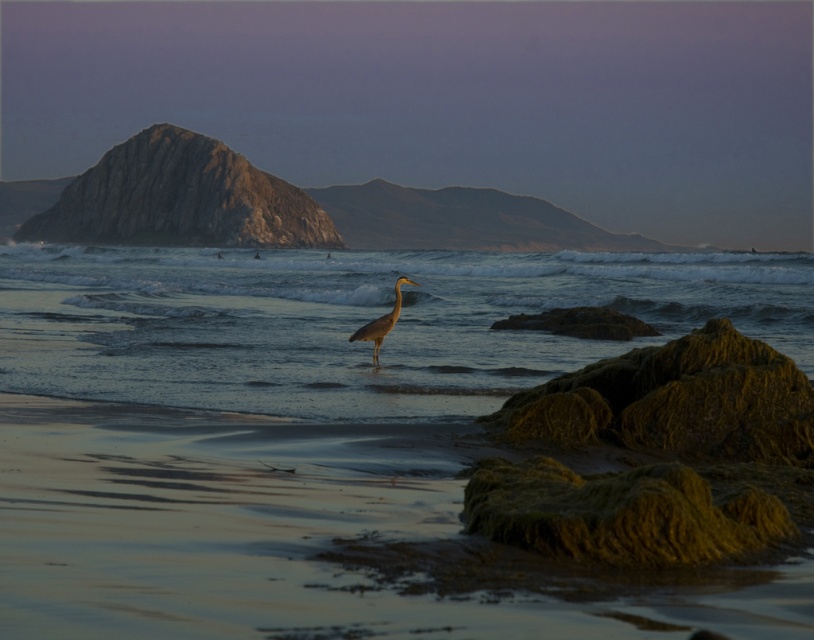
Does sandy water at center have a greater width compared to gray matte heron at center?

Yes.

At what (x,y) coordinates should I click in order to perform the action: click on sandy water at center. Please return your answer as a coordinate pair (x, y). The image size is (814, 640). Looking at the image, I should click on (355, 323).